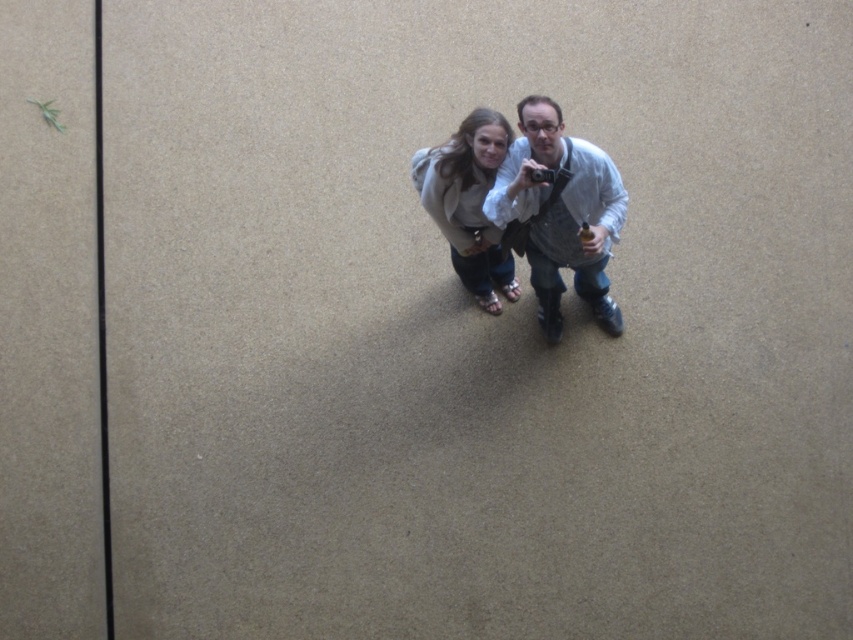
Question: Among these points, which one is nearest to the camera?

Choices:
 (A) (529, 262)
 (B) (468, 166)

Answer: (B)

Question: Is white shirt at center smaller than light beige sweater at center?

Choices:
 (A) yes
 (B) no

Answer: (B)

Question: Is white shirt at center further to the viewer compared to light beige sweater at center?

Choices:
 (A) no
 (B) yes

Answer: (A)

Question: Which object is farther from the camera taking this photo?

Choices:
 (A) white shirt at center
 (B) light beige sweater at center

Answer: (B)

Question: Which of the following is the farthest from the observer?

Choices:
 (A) (583, 280)
 (B) (434, 156)

Answer: (A)

Question: Does white shirt at center lie in front of light beige sweater at center?

Choices:
 (A) no
 (B) yes

Answer: (B)